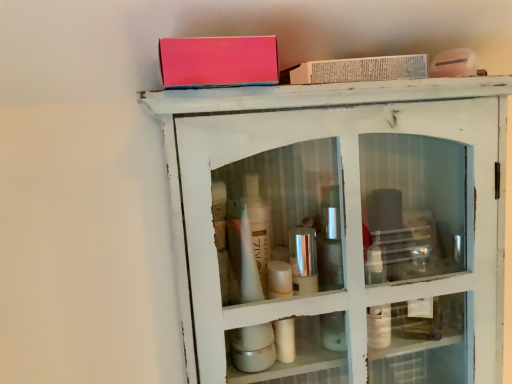
This screenshot has width=512, height=384. Describe the element at coordinates (358, 70) in the screenshot. I see `white paper book at upper center, the 1th book positioned from the right` at that location.

At what (x,y) coordinates should I click in order to perform the action: click on matte pink box at upper center, positioned as the first book in front-to-back order. Please return your answer as a coordinate pair (x, y). The width and height of the screenshot is (512, 384). Looking at the image, I should click on (218, 61).

Is white paper book at upper center, positioned as the 2th book in front-to-back order, looking in the opposite direction of matte pink box at upper center, the 2th book viewed from the right?

No.

Is white paper book at upper center, positioned as the 2th book in front-to-back order, positioned far away from matte pink box at upper center, which is the 2th book in back-to-front order?

No, there isn't a large distance between white paper book at upper center, positioned as the 2th book in front-to-back order, and matte pink box at upper center, which is the 2th book in back-to-front order.

From the image's perspective, is white paper book at upper center, the 1th book positioned from the right, above matte pink box at upper center, which is the 2th book in back-to-front order?

Indeed, from the image's perspective, white paper book at upper center, the 1th book positioned from the right, is shown above matte pink box at upper center, which is the 2th book in back-to-front order.

Could you measure the distance between white paper book at upper center, the 1th book viewed from the back, and matte pink box at upper center, the 2th book viewed from the right?

3.34 inches.

Is white distressed cabinet at upper center thinner than matte pink box at upper center, marked as the first book in a left-to-right arrangement?

In fact, white distressed cabinet at upper center might be wider than matte pink box at upper center, marked as the first book in a left-to-right arrangement.

From the image's perspective, which is above, white distressed cabinet at upper center or matte pink box at upper center, positioned as the first book in front-to-back order?

matte pink box at upper center, positioned as the first book in front-to-back order.

Looking at this image, which is correct: white distressed cabinet at upper center is inside matte pink box at upper center, the 2th book viewed from the right, or outside of it?

white distressed cabinet at upper center exists outside the volume of matte pink box at upper center, the 2th book viewed from the right.

From a real-world perspective, which is physically below, white distressed cabinet at upper center or matte pink box at upper center, which is the 2th book in back-to-front order?

white distressed cabinet at upper center is physically lower.

Could white distressed cabinet at upper center be considered to be inside white paper book at upper center, the 1th book viewed from the back?

No, white distressed cabinet at upper center is not surrounded by white paper book at upper center, the 1th book viewed from the back.

Is white paper book at upper center, the 1th book positioned from the right, thinner than white distressed cabinet at upper center?

Yes, white paper book at upper center, the 1th book positioned from the right, is thinner than white distressed cabinet at upper center.

From the image's perspective, is white paper book at upper center, the 1th book positioned from the right, located above white distressed cabinet at upper center?

Yes.

Between point (310, 302) and point (414, 62), which one is positioned in front?

The point (414, 62) is in front.

From the image's perspective, is white distressed cabinet at upper center positioned above or below white paper book at upper center, positioned as the 2th book in front-to-back order?

From the image's perspective, white distressed cabinet at upper center appears below white paper book at upper center, positioned as the 2th book in front-to-back order.

Between white distressed cabinet at upper center and white paper book at upper center, positioned as the 2th book in front-to-back order, which one has more height?

Standing taller between the two is white distressed cabinet at upper center.

In the scene shown: Would you say white distressed cabinet at upper center is inside or outside white paper book at upper center, the 1th book viewed from the back?

The correct answer is: outside.

Which object is more forward, matte pink box at upper center, which is the 2th book in back-to-front order, or white distressed cabinet at upper center?

matte pink box at upper center, which is the 2th book in back-to-front order, is more forward.

Between matte pink box at upper center, marked as the first book in a left-to-right arrangement, and white distressed cabinet at upper center, which one has larger size?

Bigger between the two is white distressed cabinet at upper center.

Does matte pink box at upper center, which is the 2th book in back-to-front order, appear on the right side of white distressed cabinet at upper center?

Incorrect, matte pink box at upper center, which is the 2th book in back-to-front order, is not on the right side of white distressed cabinet at upper center.

From a real-world perspective, is matte pink box at upper center, positioned as the first book in front-to-back order, positioned above or below white paper book at upper center, the 1th book viewed from the back?

matte pink box at upper center, positioned as the first book in front-to-back order, is situated lower than white paper book at upper center, the 1th book viewed from the back, in the real world.

Consider the image. Is matte pink box at upper center, marked as the first book in a left-to-right arrangement, not close to white paper book at upper center, the 1th book viewed from the back?

matte pink box at upper center, marked as the first book in a left-to-right arrangement, is actually quite close to white paper book at upper center, the 1th book viewed from the back.

What's the angular difference between matte pink box at upper center, positioned as the first book in front-to-back order, and white paper book at upper center, the 1th book positioned from the right,'s facing directions?

The angle between the facing direction of matte pink box at upper center, positioned as the first book in front-to-back order, and the facing direction of white paper book at upper center, the 1th book positioned from the right, is 0.00112 degrees.

Considering the positions of points (180, 73) and (286, 69), is point (180, 73) farther from camera compared to point (286, 69)?

No, (180, 73) is closer to viewer.

Locate an element on the screen. This screenshot has width=512, height=384. book in front of the white paper book at upper center, acting as the second book starting from the left is located at coordinates (218, 61).

Find the location of a particular element. This screenshot has height=384, width=512. shelf below the matte pink box at upper center, the 2th book viewed from the right (from the image's perspective) is located at coordinates (339, 230).

Looking at the image, which one is located further to white paper book at upper center, positioned as the 2th book in front-to-back order, white distressed cabinet at upper center or matte pink box at upper center, the 2th book viewed from the right?

white distressed cabinet at upper center lies further to white paper book at upper center, positioned as the 2th book in front-to-back order, than the other object.

Looking at the image, which one is located closer to matte pink box at upper center, marked as the first book in a left-to-right arrangement, white paper book at upper center, the 1th book positioned from the right, or white distressed cabinet at upper center?

white paper book at upper center, the 1th book positioned from the right, is positioned closer to the anchor matte pink box at upper center, marked as the first book in a left-to-right arrangement.

From the image, which object appears to be farther from white distressed cabinet at upper center, white paper book at upper center, the 1th book viewed from the back, or matte pink box at upper center, the 2th book viewed from the right?

matte pink box at upper center, the 2th book viewed from the right, lies further to white distressed cabinet at upper center than the other object.

From the image, which object appears to be nearer to white paper book at upper center, the 1th book viewed from the back, matte pink box at upper center, marked as the first book in a left-to-right arrangement, or white distressed cabinet at upper center?

Based on the image, matte pink box at upper center, marked as the first book in a left-to-right arrangement, appears to be nearer to white paper book at upper center, the 1th book viewed from the back.

Considering their positions, is white distressed cabinet at upper center positioned further to matte pink box at upper center, marked as the first book in a left-to-right arrangement, than white paper book at upper center, the 1th book positioned from the right?

white distressed cabinet at upper center lies further to matte pink box at upper center, marked as the first book in a left-to-right arrangement, than the other object.

When comparing their distances from white distressed cabinet at upper center, does matte pink box at upper center, positioned as the first book in front-to-back order, or white paper book at upper center, acting as the second book starting from the left, seem further?

matte pink box at upper center, positioned as the first book in front-to-back order, is positioned further to the anchor white distressed cabinet at upper center.

Locate an element on the screen. book between white paper book at upper center, the 1th book viewed from the back, and white distressed cabinet at upper center, in the vertical direction is located at coordinates (218, 61).